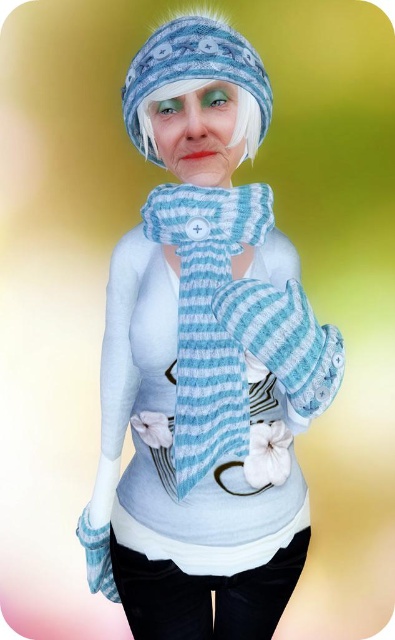
Measure the distance between knitted blue-white striped scarf at center and camera.

knitted blue-white striped scarf at center and camera are 35.92 inches apart.

Image resolution: width=395 pixels, height=640 pixels. Identify the location of knitted blue-white striped scarf at center. click(x=206, y=316).

This screenshot has height=640, width=395. I want to click on knitted blue-white striped scarf at center, so click(206, 316).

Is knitted wool scarf at center to the right of white fuzzy hat at upper center from the viewer's perspective?

Yes, knitted wool scarf at center is to the right of white fuzzy hat at upper center.

From the picture: Which is more to the left, knitted wool scarf at center or white fuzzy hat at upper center?

Positioned to the left is white fuzzy hat at upper center.

Is point (107, 525) farther from camera compared to point (173, 93)?

Yes.

The height and width of the screenshot is (640, 395). Find the location of `knitted wool scarf at center`. knitted wool scarf at center is located at coordinates (203, 358).

Can you confirm if knitted wool scarf at center is shorter than fuzzy woolen hat at upper center?

No, knitted wool scarf at center is not shorter than fuzzy woolen hat at upper center.

At what (x,y) coordinates should I click in order to perform the action: click on knitted wool scarf at center. Please return your answer as a coordinate pair (x, y). This screenshot has width=395, height=640. Looking at the image, I should click on (203, 358).

This screenshot has height=640, width=395. Identify the location of knitted wool scarf at center. (203, 358).